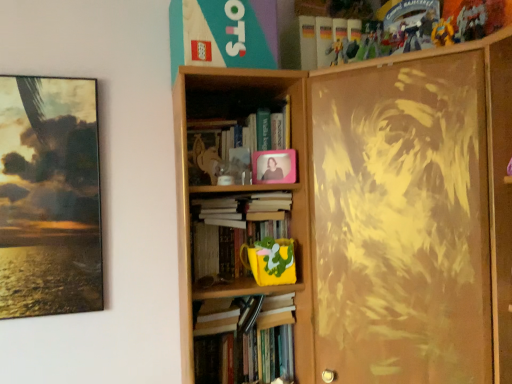
Question: Is wooden bookcase at center, which is the 2th bookcase in right-to-left order, inside matte paper book at upper center?

Choices:
 (A) no
 (B) yes

Answer: (A)

Question: From the image's perspective, is matte paper book at upper center located beneath wooden bookcase at center, which is the 2th bookcase in right-to-left order?

Choices:
 (A) no
 (B) yes

Answer: (A)

Question: Is the position of matte paper book at upper center less distant than that of wooden bookcase at center, which is the 2th bookcase in right-to-left order?

Choices:
 (A) yes
 (B) no

Answer: (B)

Question: Can we say matte paper book at upper center lies outside wooden bookcase at center, the 1th bookcase in the left-to-right sequence?

Choices:
 (A) yes
 (B) no

Answer: (A)

Question: Are matte paper book at upper center and wooden bookcase at center, which is the 2th bookcase in right-to-left order, making contact?

Choices:
 (A) no
 (B) yes

Answer: (A)

Question: Is point (425, 157) closer or farther from the camera than point (219, 372)?

Choices:
 (A) farther
 (B) closer

Answer: (B)

Question: Based on their sizes in the image, would you say matte brown painting at right, arranged as the second bookcase when viewed from the left, is bigger or smaller than hardcover book at center, the 3th book from the top?

Choices:
 (A) small
 (B) big

Answer: (B)

Question: Considering their positions, is matte brown painting at right, the 1th bookcase viewed from the right, located in front of or behind hardcover book at center, which appears as the 1th book when ordered from the bottom?

Choices:
 (A) front
 (B) behind

Answer: (A)

Question: In the image, is matte brown painting at right, arranged as the second bookcase when viewed from the left, on the left side or the right side of hardcover book at center, the 3th book from the top?

Choices:
 (A) left
 (B) right

Answer: (B)

Question: Considering the positions of wooden bookcase at center, which is the 2th bookcase in right-to-left order, and matte brown painting at right, the 1th bookcase viewed from the right, in the image, is wooden bookcase at center, which is the 2th bookcase in right-to-left order, taller or shorter than matte brown painting at right, the 1th bookcase viewed from the right,?

Choices:
 (A) short
 (B) tall

Answer: (A)

Question: Based on their sizes in the image, would you say wooden bookcase at center, which is the 2th bookcase in right-to-left order, is bigger or smaller than matte brown painting at right, arranged as the second bookcase when viewed from the left?

Choices:
 (A) small
 (B) big

Answer: (A)

Question: Is point (280, 94) positioned closer to the camera than point (465, 132)?

Choices:
 (A) farther
 (B) closer

Answer: (A)

Question: Is wooden bookcase at center, which is the 2th bookcase in right-to-left order, inside or outside of matte brown painting at right, the 1th bookcase viewed from the right?

Choices:
 (A) inside
 (B) outside

Answer: (B)

Question: Is point (184, 246) positioned closer to the camera than point (206, 218)?

Choices:
 (A) farther
 (B) closer

Answer: (B)

Question: Do you think wooden bookcase at center, the 1th bookcase in the left-to-right sequence, is within yellow matte mug at center, the second book from the top, or outside of it?

Choices:
 (A) outside
 (B) inside

Answer: (A)